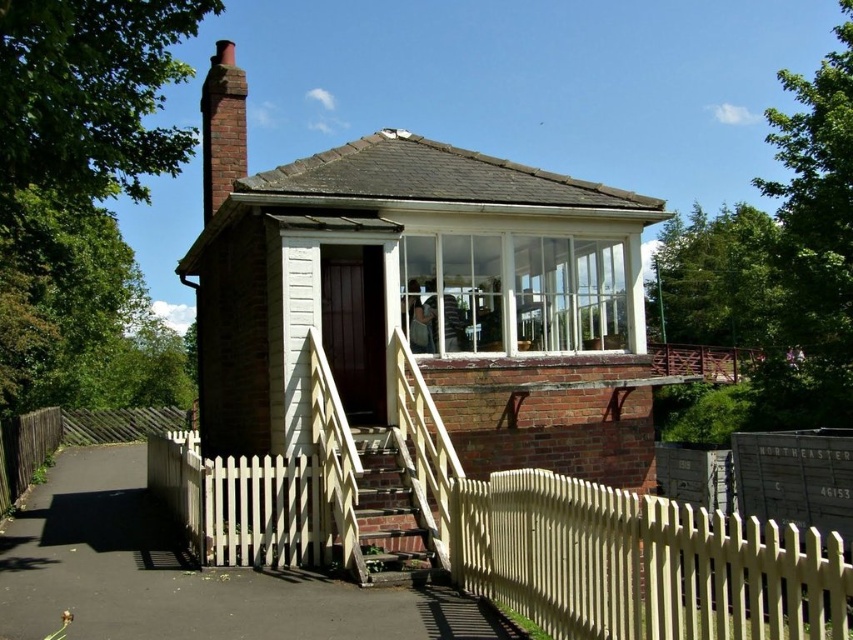
Question: Which point appears closest to the camera in this image?

Choices:
 (A) (762, 598)
 (B) (241, 138)
 (C) (575, 564)

Answer: (A)

Question: Observing the image, what is the correct spatial positioning of white picket fence at lower center in reference to white picket fence at lower right?

Choices:
 (A) above
 (B) below

Answer: (B)

Question: Which object is farther from the camera taking this photo?

Choices:
 (A) white picket fence at lower center
 (B) white picket fence at lower right

Answer: (A)

Question: Among these objects, which one is farthest from the camera?

Choices:
 (A) brick chimney at upper left
 (B) white picket fence at lower right

Answer: (A)

Question: Does white picket fence at lower center appear on the right side of brick chimney at upper left?

Choices:
 (A) no
 (B) yes

Answer: (B)

Question: Is white picket fence at lower center wider than white picket fence at lower right?

Choices:
 (A) yes
 (B) no

Answer: (A)